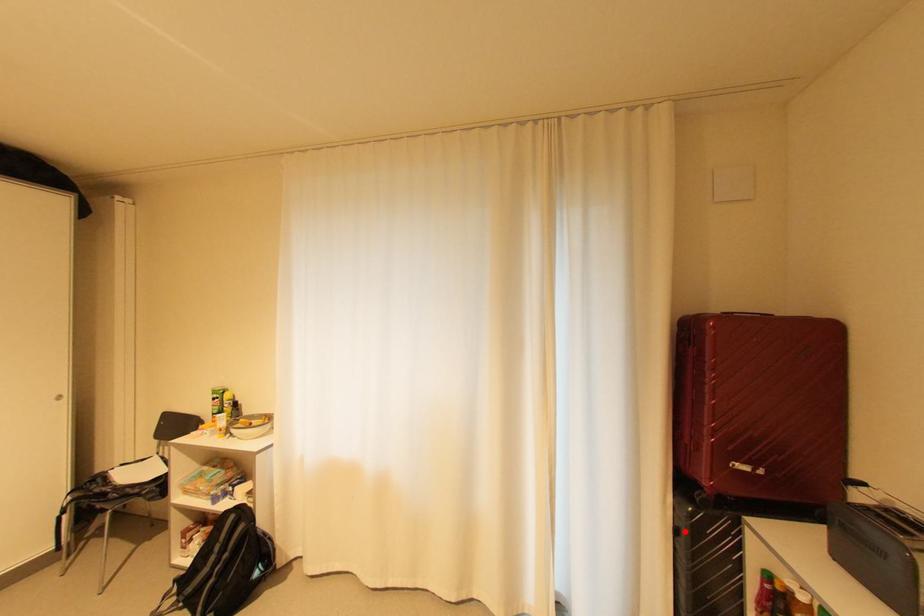
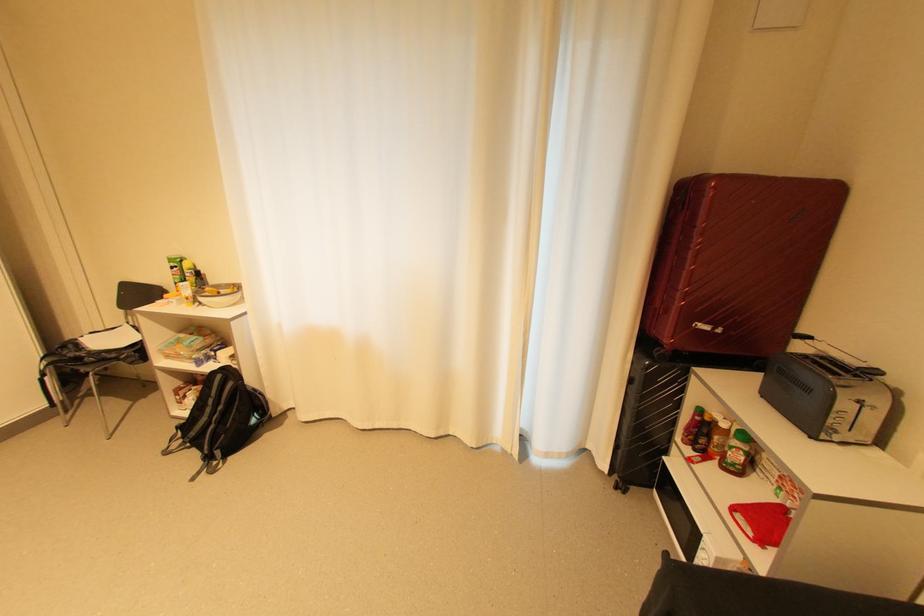
In the second image, find the point that corresponds to the highlighted location in the first image.

(638, 381)